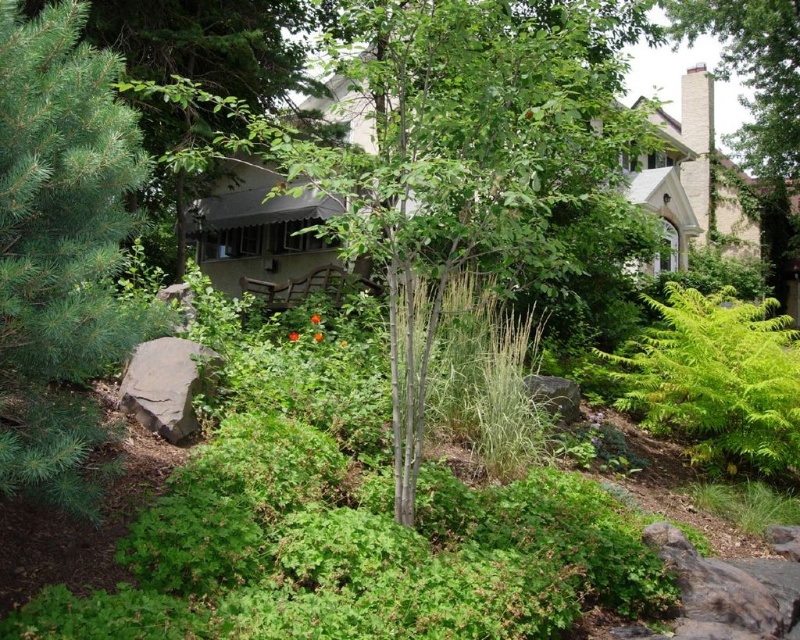
Image resolution: width=800 pixels, height=640 pixels. Describe the element at coordinates (166, 385) in the screenshot. I see `gray rough rock at lower left` at that location.

Does point (178, 412) come farther from viewer compared to point (562, 408)?

No, (178, 412) is in front of (562, 408).

Identify the location of gray rough rock at lower left. (166, 385).

Is green needle-like at left bigger than gray rough stone at center-right?

Indeed, green needle-like at left has a larger size compared to gray rough stone at center-right.

Does green needle-like at left have a smaller size compared to gray rough stone at center-right?

No, green needle-like at left is not smaller than gray rough stone at center-right.

Identify the location of green needle-like at left. The image size is (800, 640). (60, 246).

The height and width of the screenshot is (640, 800). In order to click on green needle-like at left in this screenshot , I will do `click(60, 246)`.

Which is above, green smooth tree at center or gray rough stone at center-right?

green smooth tree at center

Can you confirm if green smooth tree at center is positioned below gray rough stone at center-right?

Incorrect, green smooth tree at center is not positioned below gray rough stone at center-right.

Where is `green smooth tree at center`? This screenshot has height=640, width=800. green smooth tree at center is located at coordinates (454, 156).

Locate an element on the screen. This screenshot has width=800, height=640. green smooth tree at center is located at coordinates (454, 156).